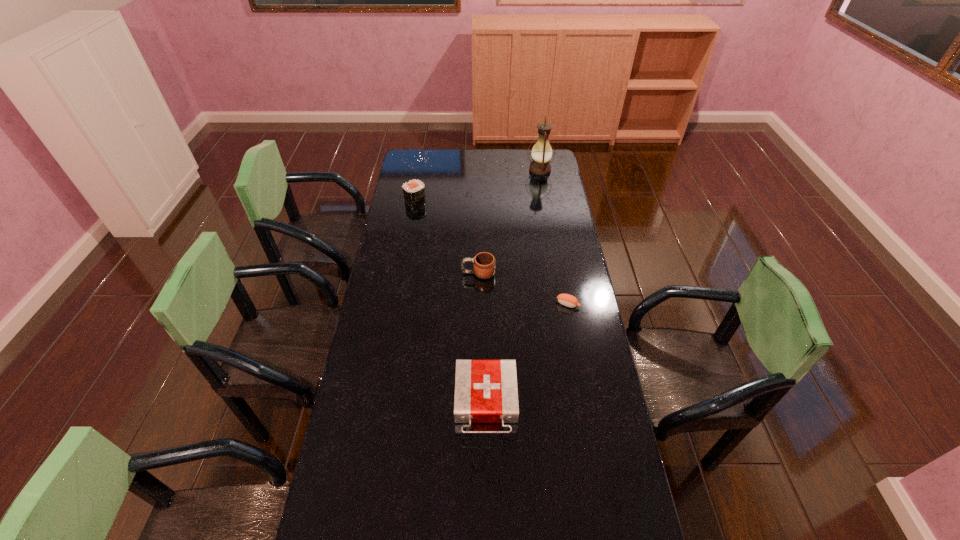
Where is `free space in the image that satisfies the following two spatial constraints: 1. on the back side of the right sushi; 2. on the side of the mug with the handle`? This screenshot has height=540, width=960. free space in the image that satisfies the following two spatial constraints: 1. on the back side of the right sushi; 2. on the side of the mug with the handle is located at coordinates [x=563, y=273].